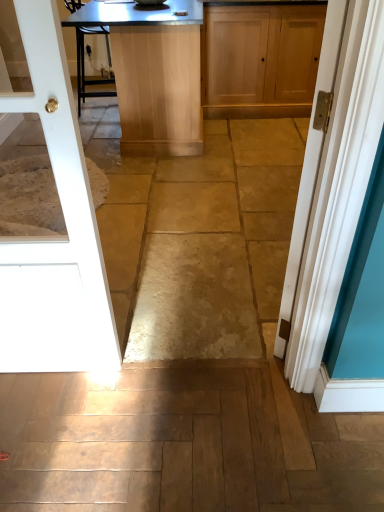
Question: Is the position of white glossy door at left, arranged as the first door when viewed from the left, more distant than that of matte wood cabinet at upper center?

Choices:
 (A) no
 (B) yes

Answer: (A)

Question: Would you say white glossy door at left, acting as the second door starting from the right, is outside matte wood cabinet at upper center?

Choices:
 (A) no
 (B) yes

Answer: (B)

Question: Is white glossy door at left, acting as the second door starting from the right, smaller than matte wood cabinet at upper center?

Choices:
 (A) yes
 (B) no

Answer: (A)

Question: Could matte wood cabinet at upper center be considered to be inside white glossy door at left, acting as the second door starting from the right?

Choices:
 (A) no
 (B) yes

Answer: (A)

Question: Considering the relative sizes of white glossy door at left, arranged as the first door when viewed from the left, and matte wood cabinet at upper center in the image provided, is white glossy door at left, arranged as the first door when viewed from the left, thinner than matte wood cabinet at upper center?

Choices:
 (A) no
 (B) yes

Answer: (B)

Question: Which is correct: white painted wood door at right, marked as the first door in a right-to-left arrangement, is inside white glossy door at left, acting as the second door starting from the right, or outside of it?

Choices:
 (A) outside
 (B) inside

Answer: (A)

Question: From the image's perspective, is white painted wood door at right, marked as the first door in a right-to-left arrangement, positioned above or below white glossy door at left, acting as the second door starting from the right?

Choices:
 (A) below
 (B) above

Answer: (B)

Question: Based on their sizes in the image, would you say white painted wood door at right, marked as the first door in a right-to-left arrangement, is bigger or smaller than white glossy door at left, arranged as the first door when viewed from the left?

Choices:
 (A) small
 (B) big

Answer: (B)

Question: Would you say white painted wood door at right, positioned as the 2th door in left-to-right order, is to the left or to the right of white glossy door at left, arranged as the first door when viewed from the left, in the picture?

Choices:
 (A) right
 (B) left

Answer: (A)

Question: From the image's perspective, is matte wood cabinet at upper center above or below light brown wooden table at center?

Choices:
 (A) above
 (B) below

Answer: (A)

Question: Would you say matte wood cabinet at upper center is inside or outside light brown wooden table at center?

Choices:
 (A) inside
 (B) outside

Answer: (B)

Question: From their relative heights in the image, would you say matte wood cabinet at upper center is taller or shorter than light brown wooden table at center?

Choices:
 (A) short
 (B) tall

Answer: (A)

Question: From a real-world perspective, is matte wood cabinet at upper center physically located above or below light brown wooden table at center?

Choices:
 (A) below
 (B) above

Answer: (A)

Question: From their relative heights in the image, would you say white painted wood door at right, positioned as the 2th door in left-to-right order, is taller or shorter than light brown wooden table at center?

Choices:
 (A) tall
 (B) short

Answer: (A)

Question: In the image, is white painted wood door at right, marked as the first door in a right-to-left arrangement, positioned in front of or behind light brown wooden table at center?

Choices:
 (A) front
 (B) behind

Answer: (A)